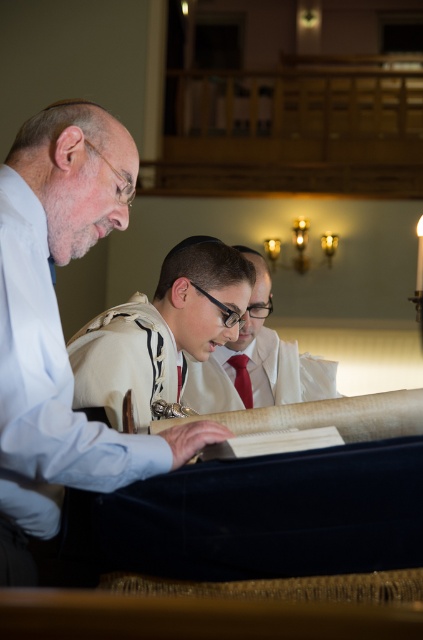
Question: Which object is the closest to the white fabric kippah at upper center?

Choices:
 (A) red satin tie at center
 (B) matte white kippah at center
 (C) matte white shirt at center

Answer: (B)

Question: Which point is closer to the camera?

Choices:
 (A) (181, 330)
 (B) (242, 376)

Answer: (A)

Question: Does matte white shirt at center have a larger size compared to red satin tie at center?

Choices:
 (A) no
 (B) yes

Answer: (B)

Question: Estimate the real-world distances between objects in this image. Which object is closer to the matte white shirt at center?

Choices:
 (A) white fabric kippah at upper center
 (B) red satin tie at center
 (C) matte white kippah at center

Answer: (B)

Question: Does matte white kippah at center come behind matte white shirt at center?

Choices:
 (A) no
 (B) yes

Answer: (A)

Question: Can you confirm if white fabric kippah at upper center is smaller than matte white shirt at center?

Choices:
 (A) yes
 (B) no

Answer: (B)